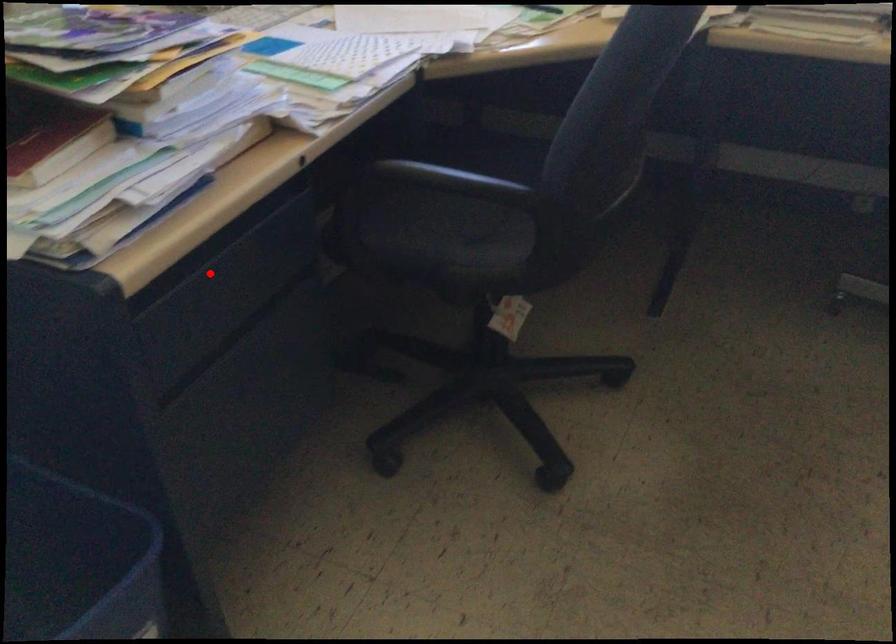
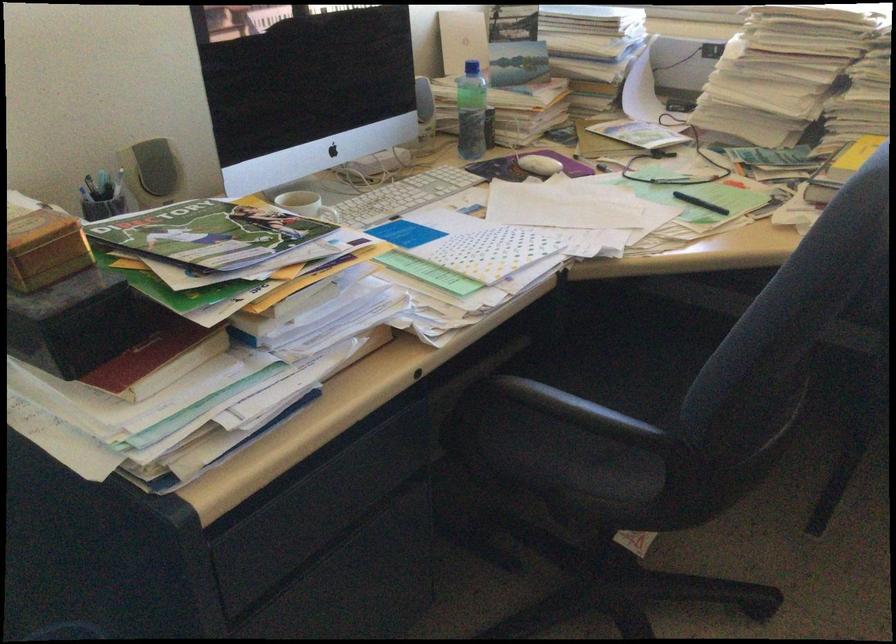
Locate, in the second image, the point that corresponds to the highlighted location in the first image.

(300, 491)